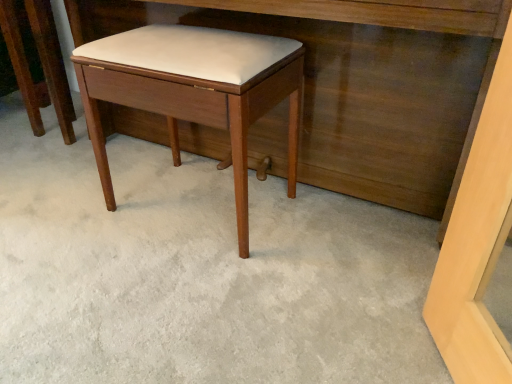
You are a GUI agent. You are given a task and a screenshot of the screen. Output one action in this format:
    pyautogui.click(x=<x>, y=<y>)
    Task: Click on the vacant space in matte wood stool at center (from a real-world perspective)
    
    Given the screenshot: What is the action you would take?
    pyautogui.click(x=181, y=212)